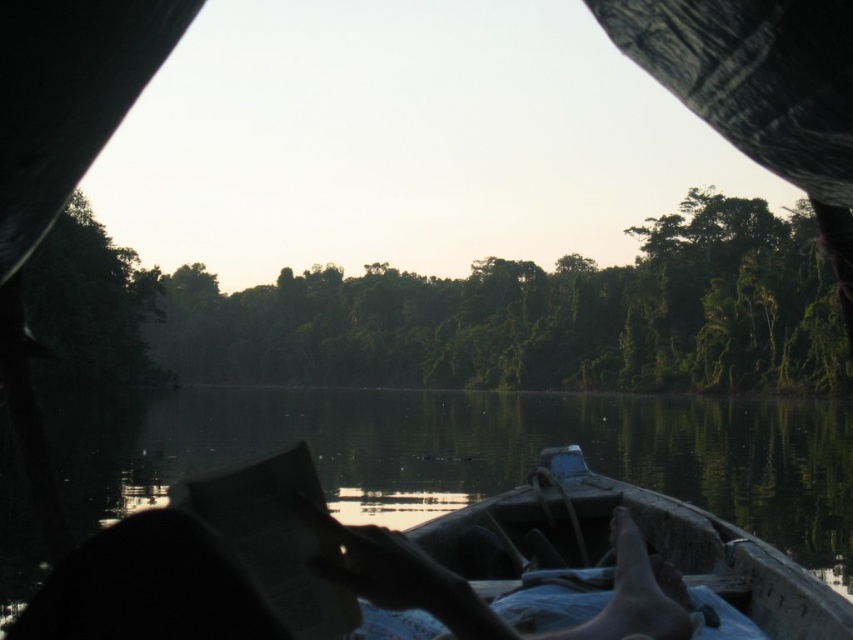
Question: Among these objects, which one is farthest from the camera?

Choices:
 (A) dark skin at lower center
 (B) transparent water at center

Answer: (B)

Question: Which is farther from the wooden canoe at center?

Choices:
 (A) transparent water at center
 (B) dark skin at lower center

Answer: (A)

Question: From the image, what is the correct spatial relationship of transparent water at center in relation to dark skin at lower center?

Choices:
 (A) below
 (B) above

Answer: (A)

Question: Is transparent water at center thinner than dark skin at lower center?

Choices:
 (A) yes
 (B) no

Answer: (B)

Question: Among these objects, which one is farthest from the camera?

Choices:
 (A) wooden canoe at center
 (B) transparent water at center

Answer: (B)

Question: Does transparent water at center have a smaller size compared to wooden canoe at center?

Choices:
 (A) yes
 (B) no

Answer: (B)